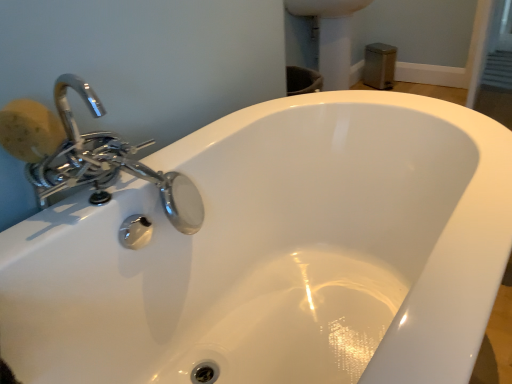
Question: Is yellow sponge at left in front of or behind satin nickel sink at upper right in the image?

Choices:
 (A) behind
 (B) front

Answer: (B)

Question: From a real-world perspective, is yellow sponge at left above or below satin nickel sink at upper right?

Choices:
 (A) above
 (B) below

Answer: (A)

Question: Visually, is yellow sponge at left positioned to the left or to the right of satin nickel sink at upper right?

Choices:
 (A) right
 (B) left

Answer: (B)

Question: Based on their sizes in the image, would you say satin nickel sink at upper right is bigger or smaller than yellow sponge at left?

Choices:
 (A) small
 (B) big

Answer: (B)

Question: From the image's perspective, is satin nickel sink at upper right above or below yellow sponge at left?

Choices:
 (A) above
 (B) below

Answer: (A)

Question: From a real-world perspective, relative to yellow sponge at left, is satin nickel sink at upper right vertically above or below?

Choices:
 (A) above
 (B) below

Answer: (B)

Question: Does point (348, 21) appear closer or farther from the camera than point (31, 112)?

Choices:
 (A) farther
 (B) closer

Answer: (A)